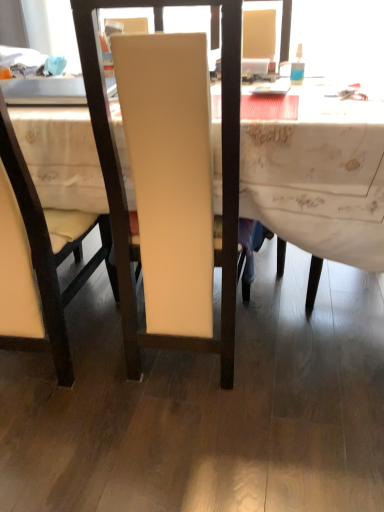
Question: Which direction should I rotate to look at matte cream chair at center, the 1th chair in the left-to-right sequence, — up or down?

Choices:
 (A) down
 (B) up

Answer: (B)

Question: Is translucent plastic bottle at upper right aimed at matte cream chair at center, the 1th chair in the left-to-right sequence?

Choices:
 (A) no
 (B) yes

Answer: (A)

Question: From the image's perspective, would you say translucent plastic bottle at upper right is positioned over matte cream chair at center, the 1th chair in the left-to-right sequence?

Choices:
 (A) yes
 (B) no

Answer: (A)

Question: Considering the relative positions of translucent plastic bottle at upper right and matte cream chair at center, which is the second chair from right to left, in the image provided, is translucent plastic bottle at upper right behind matte cream chair at center, which is the second chair from right to left,?

Choices:
 (A) no
 (B) yes

Answer: (B)

Question: Is translucent plastic bottle at upper right far from matte cream chair at center, the 1th chair in the left-to-right sequence?

Choices:
 (A) yes
 (B) no

Answer: (B)

Question: Is translucent plastic bottle at upper right looking in the opposite direction of matte cream chair at center, the 1th chair in the left-to-right sequence?

Choices:
 (A) no
 (B) yes

Answer: (A)

Question: Is translucent plastic bottle at upper right closer to camera compared to matte cream chair at center, the 1th chair in the left-to-right sequence?

Choices:
 (A) no
 (B) yes

Answer: (A)

Question: Is there a large distance between matte white chair at center, marked as the 1th chair in a right-to-left arrangement, and matte cream chair at center, which is the second chair from right to left?

Choices:
 (A) no
 (B) yes

Answer: (A)

Question: Is matte white chair at center, arranged as the 2th chair when viewed from the left, located outside matte cream chair at center, the 1th chair in the left-to-right sequence?

Choices:
 (A) no
 (B) yes

Answer: (B)

Question: Is the depth of matte white chair at center, marked as the 1th chair in a right-to-left arrangement, greater than that of matte cream chair at center, which is the second chair from right to left?

Choices:
 (A) yes
 (B) no

Answer: (A)

Question: Is matte white chair at center, marked as the 1th chair in a right-to-left arrangement, facing away from matte cream chair at center, the 1th chair in the left-to-right sequence?

Choices:
 (A) yes
 (B) no

Answer: (B)

Question: From the image's perspective, is matte white chair at center, marked as the 1th chair in a right-to-left arrangement, on top of matte cream chair at center, the 1th chair in the left-to-right sequence?

Choices:
 (A) yes
 (B) no

Answer: (A)

Question: Is matte white chair at center, arranged as the 2th chair when viewed from the left, aimed at matte cream chair at center, which is the second chair from right to left?

Choices:
 (A) yes
 (B) no

Answer: (B)

Question: Is matte cream chair at center, which is the second chair from right to left, positioned in front of white fabric desk at center?

Choices:
 (A) no
 (B) yes

Answer: (B)